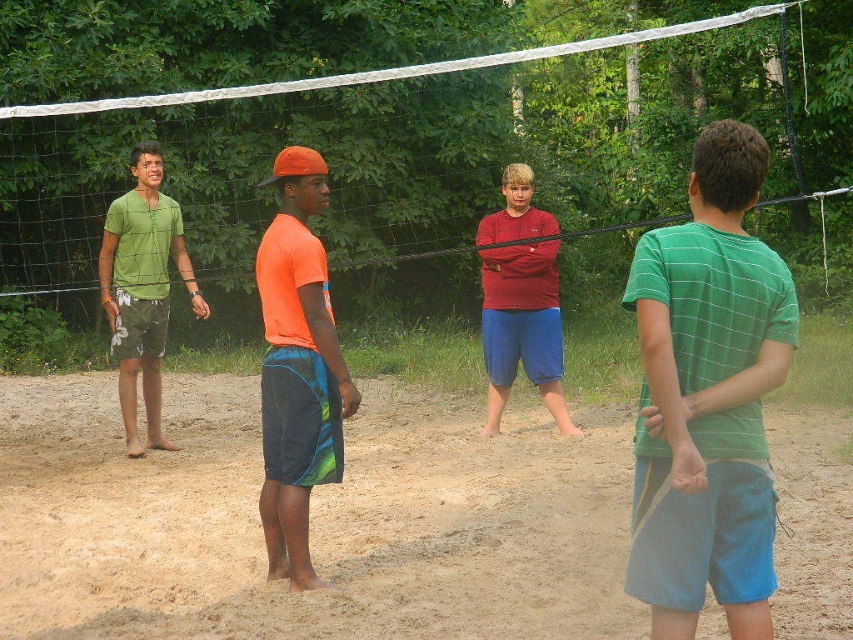
Question: Which object is closer to the camera taking this photo?

Choices:
 (A) green matte shorts at left
 (B) brown sandy dirt at lower center
 (C) green striped shirt at center
 (D) orange matte t-shirt at center

Answer: (C)

Question: Which of the following is the farthest from the observer?

Choices:
 (A) (44, 490)
 (B) (297, 296)
 (C) (144, 340)

Answer: (C)

Question: Which object appears closest to the camera in this image?

Choices:
 (A) brown sandy dirt at lower center
 (B) white mesh net at center
 (C) matte red shirt at center

Answer: (A)

Question: Is green striped shirt at center in front of matte red shirt at center?

Choices:
 (A) yes
 (B) no

Answer: (A)

Question: Can you confirm if white mesh net at center is smaller than orange matte t-shirt at center?

Choices:
 (A) yes
 (B) no

Answer: (B)

Question: Is brown sandy dirt at lower center further to the viewer compared to green striped shirt at center?

Choices:
 (A) no
 (B) yes

Answer: (B)